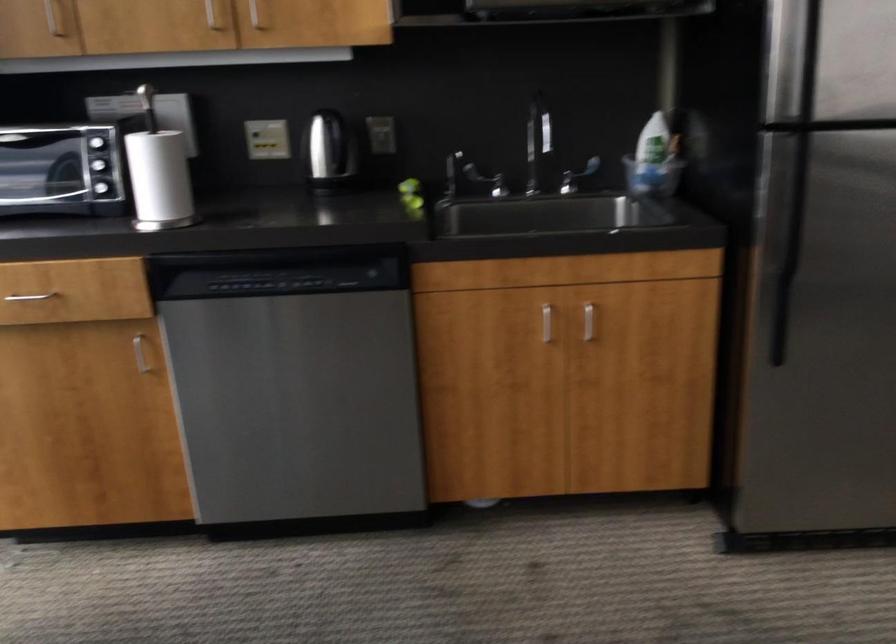
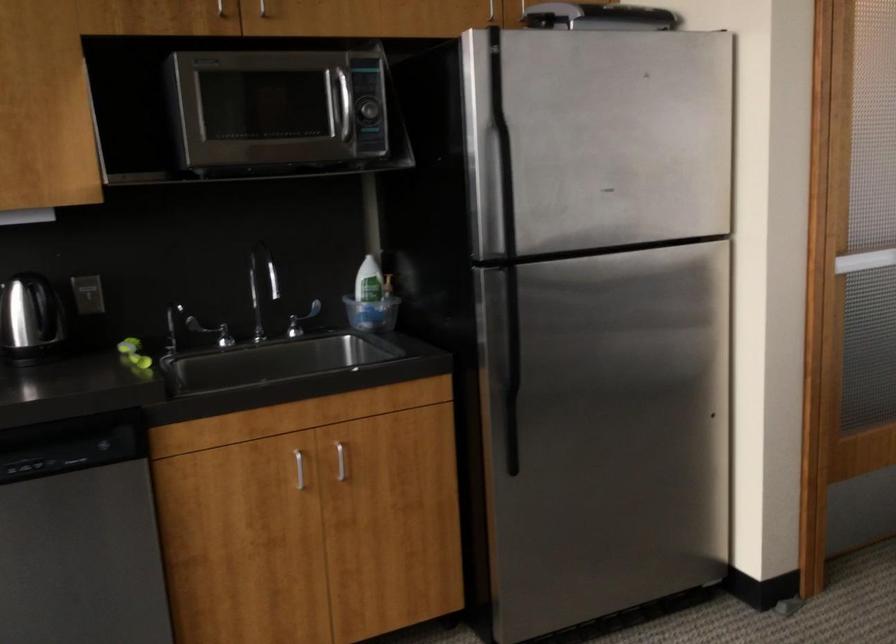
Question: Which direction would the cameraman need to move to produce the second image? Reply with the corresponding letter.

Choices:
 (A) Left
 (B) Right
 (C) Forward
 (D) Backward

Answer: (A)